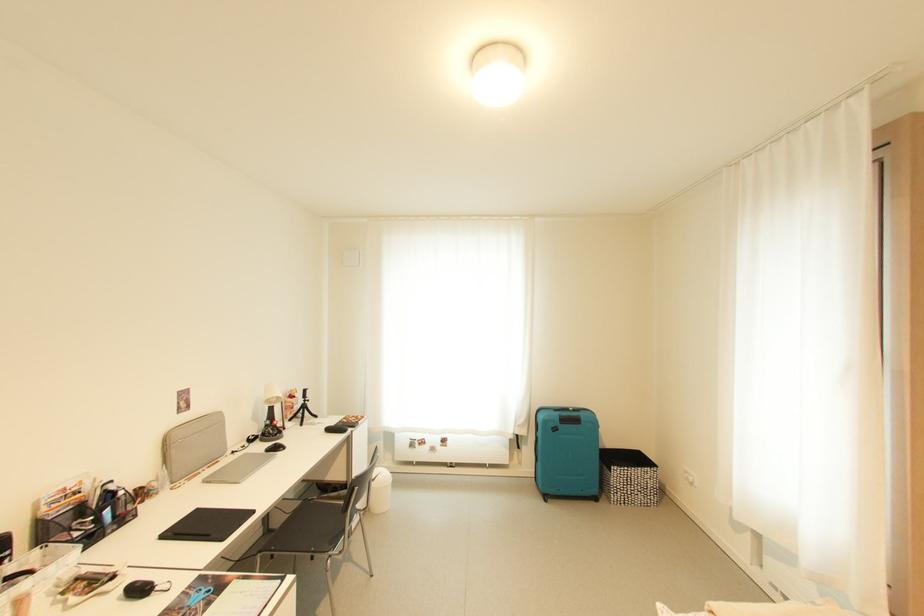
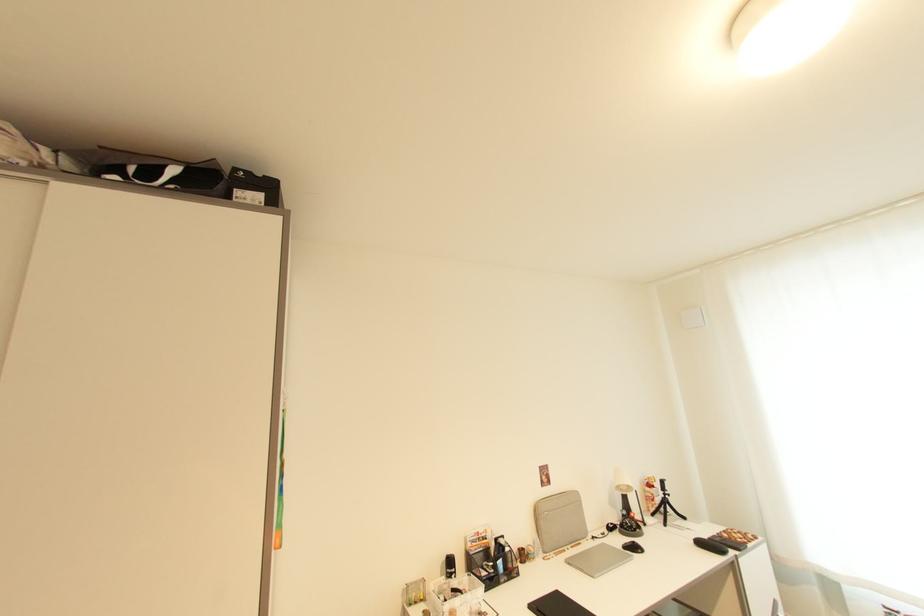
Locate, in the second image, the point that corresponds to [177,455] in the first image.

(546, 525)